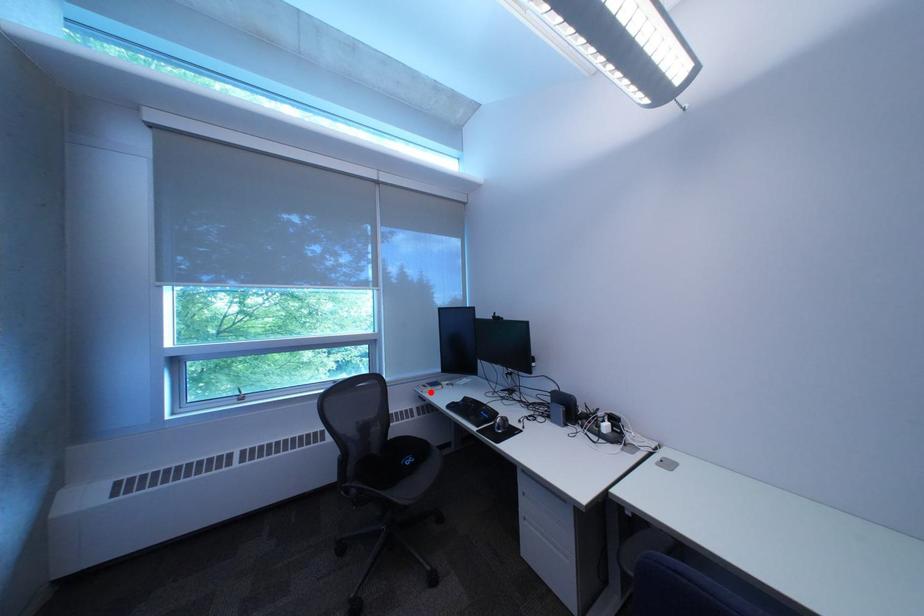
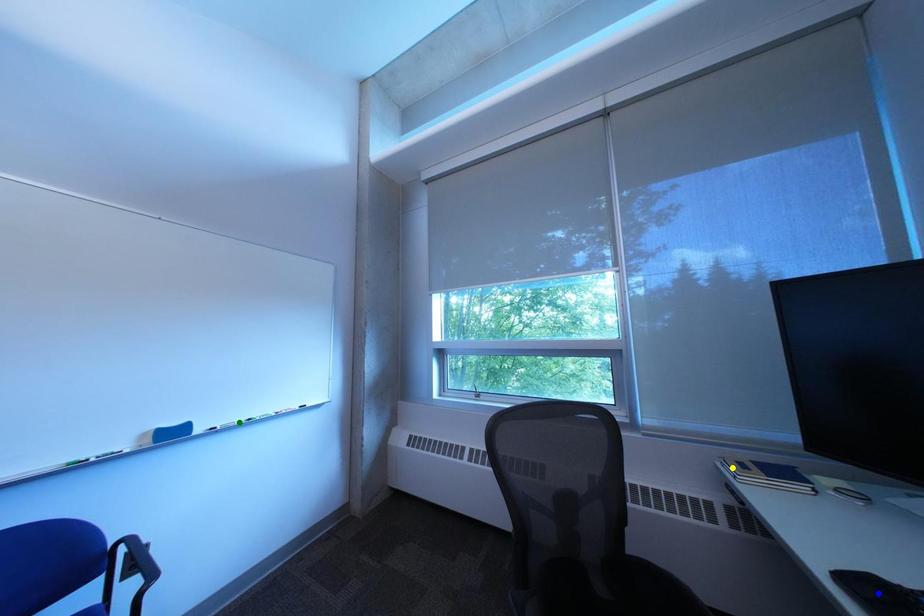
Question: I am providing you with two images of the same scene from different viewpoints. A red point is marked on the first image. You are given multiple points on the second image. Can you choose the point in image 2 that corresponds to the point in image 1?

Choices:
 (A) yellow point
 (B) blue point
 (C) green point

Answer: (A)